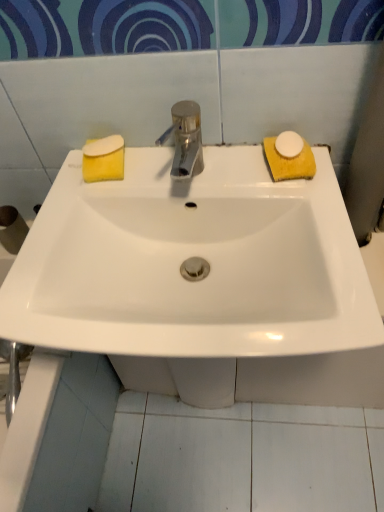
I want to click on free area in between white matte soap at right, arranged as the third soap when viewed from the left, and polished metallic tap at center, so click(242, 175).